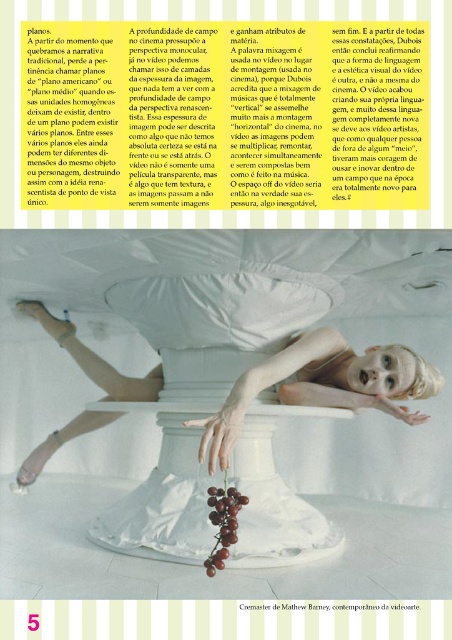
Question: Is white matte dress at center to the right of white cotton pillow at center from the viewer's perspective?

Choices:
 (A) yes
 (B) no

Answer: (A)

Question: In this image, where is white matte dress at center located relative to white cotton pillow at center?

Choices:
 (A) right
 (B) left

Answer: (A)

Question: Can you confirm if white matte dress at center is smaller than white cotton pillow at center?

Choices:
 (A) no
 (B) yes

Answer: (A)

Question: Which object is closer to the camera taking this photo?

Choices:
 (A) white matte dress at center
 (B) white cotton pillow at center

Answer: (A)

Question: Among these points, which one is nearest to the camera?

Choices:
 (A) (191, 310)
 (B) (144, 397)

Answer: (A)